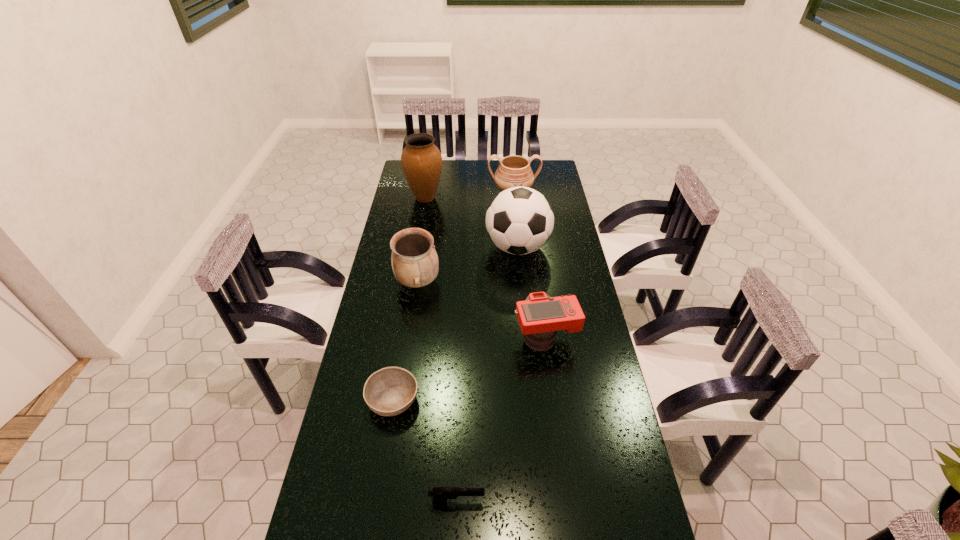
The height and width of the screenshot is (540, 960). I want to click on free space located on the front of the tallest urn, so click(x=419, y=235).

You are a GUI agent. You are given a task and a screenshot of the screen. Output one action in this format:
    pyautogui.click(x=<x>, y=<y>)
    Task: Click on the vacant space located 0.060m on the back of the soccer ball
    Image resolution: width=960 pixels, height=540 pixels.
    Given the screenshot: What is the action you would take?
    coord(515,220)

Where is `vacant space located on the front-facing side of the rightmost urn`? The image size is (960, 540). vacant space located on the front-facing side of the rightmost urn is located at coordinates (518, 245).

Image resolution: width=960 pixels, height=540 pixels. Identify the location of vacant region located on the right of the nearest urn. (479, 282).

Find the location of a particular element. Image resolution: width=960 pixels, height=540 pixels. free space located 0.370m on the back of the third shortest object is located at coordinates (534, 254).

Find the location of a particular element. This screenshot has height=540, width=960. free space located 0.150m on the front-facing side of the sixth tallest object is located at coordinates (544, 502).

Find the location of `free space located on the right of the second nearest object`. free space located on the right of the second nearest object is located at coordinates (542, 400).

The height and width of the screenshot is (540, 960). Identify the location of object that is positioned at the far edge. (514, 171).

Where is `bowl that is at the left edge`? This screenshot has width=960, height=540. bowl that is at the left edge is located at coordinates (390, 391).

Where is `soccer ball that is at the right edge`? This screenshot has width=960, height=540. soccer ball that is at the right edge is located at coordinates (519, 220).